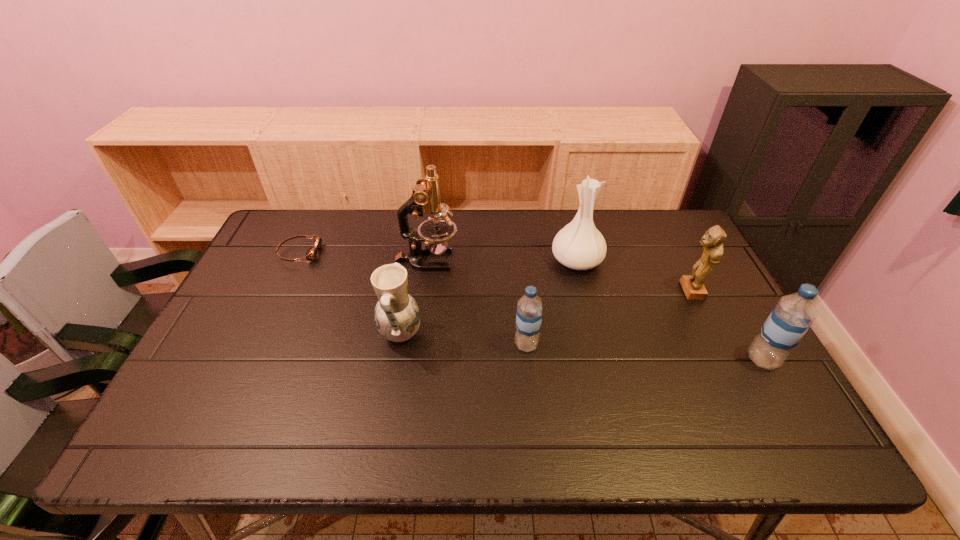
Identify the location of pottery. The image size is (960, 540). (397, 315).

You are a GUI agent. You are given a task and a screenshot of the screen. Output one action in this format:
    pyautogui.click(x=<x>, y=<y>)
    Task: Click on the vacant space located on the label of the left water bottle
    
    Given the screenshot: What is the action you would take?
    tap(678, 345)

Locate an element on the screen. The image size is (960, 540). free spot located through the lenses of the leftmost object is located at coordinates (414, 253).

Where is `free spot located on the right of the vase`? This screenshot has height=540, width=960. free spot located on the right of the vase is located at coordinates (632, 261).

Identify the location of vacant space located at the eyepiece of the microscope. The width and height of the screenshot is (960, 540). (544, 260).

Where is `vacant space situated on the front-facing side of the figurine`? vacant space situated on the front-facing side of the figurine is located at coordinates (573, 291).

Identify the location of free space located 0.280m on the front-facing side of the figurine. (584, 291).

Where is `free region located 0.100m on the front-facing side of the figurine`? This screenshot has width=960, height=540. free region located 0.100m on the front-facing side of the figurine is located at coordinates (645, 291).

This screenshot has width=960, height=540. Find the location of `vacant position located on either side of the pottery`. vacant position located on either side of the pottery is located at coordinates (442, 334).

Where is `goggles at the far edge`? goggles at the far edge is located at coordinates (311, 254).